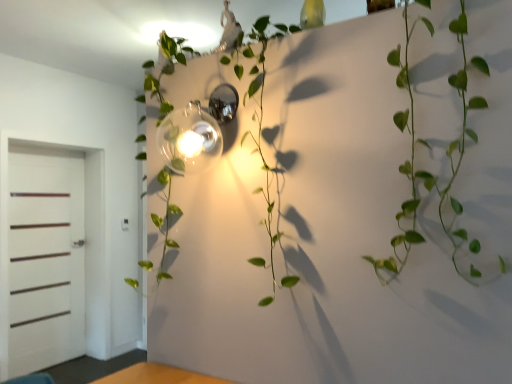
Question: Should I look upward or downward to see polished chrome sconce at center?

Choices:
 (A) up
 (B) down

Answer: (A)

Question: Could you tell me if white matte door at left is turned towards green leafy vine at center?

Choices:
 (A) yes
 (B) no

Answer: (A)

Question: From the image's perspective, would you say white matte door at left is positioned over green leafy vine at center?

Choices:
 (A) yes
 (B) no

Answer: (B)

Question: From the image's perspective, is white matte door at left under green leafy vine at center?

Choices:
 (A) no
 (B) yes

Answer: (B)

Question: Can you confirm if white matte door at left is thinner than green leafy vine at center?

Choices:
 (A) yes
 (B) no

Answer: (A)

Question: Does white matte door at left have a greater height compared to green leafy vine at center?

Choices:
 (A) yes
 (B) no

Answer: (A)

Question: From a real-world perspective, is white matte door at left on top of green leafy vine at center?

Choices:
 (A) no
 (B) yes

Answer: (A)

Question: Considering the relative positions of polished chrome sconce at center and green leafy vine at center in the image provided, is polished chrome sconce at center behind green leafy vine at center?

Choices:
 (A) yes
 (B) no

Answer: (A)

Question: Would you say polished chrome sconce at center contains green leafy vine at center?

Choices:
 (A) yes
 (B) no

Answer: (B)

Question: Is polished chrome sconce at center directly adjacent to green leafy vine at center?

Choices:
 (A) yes
 (B) no

Answer: (A)

Question: Does polished chrome sconce at center have a lesser height compared to green leafy vine at center?

Choices:
 (A) yes
 (B) no

Answer: (A)

Question: From the image's perspective, does polished chrome sconce at center appear higher than green leafy vine at center?

Choices:
 (A) no
 (B) yes

Answer: (B)

Question: Is polished chrome sconce at center bigger than green leafy vine at center?

Choices:
 (A) no
 (B) yes

Answer: (A)

Question: Is green leafy vine at center bigger than white matte door at left?

Choices:
 (A) no
 (B) yes

Answer: (B)